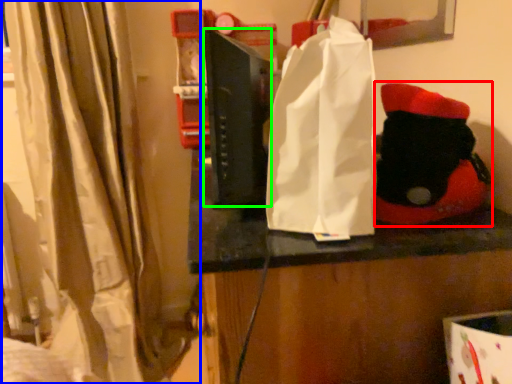
Question: Estimate the real-world distances between objects in this image. Which object is farther from toy (highlighted by a red box), curtain (highlighted by a blue box) or book (highlighted by a green box)?

Choices:
 (A) curtain
 (B) book

Answer: (A)